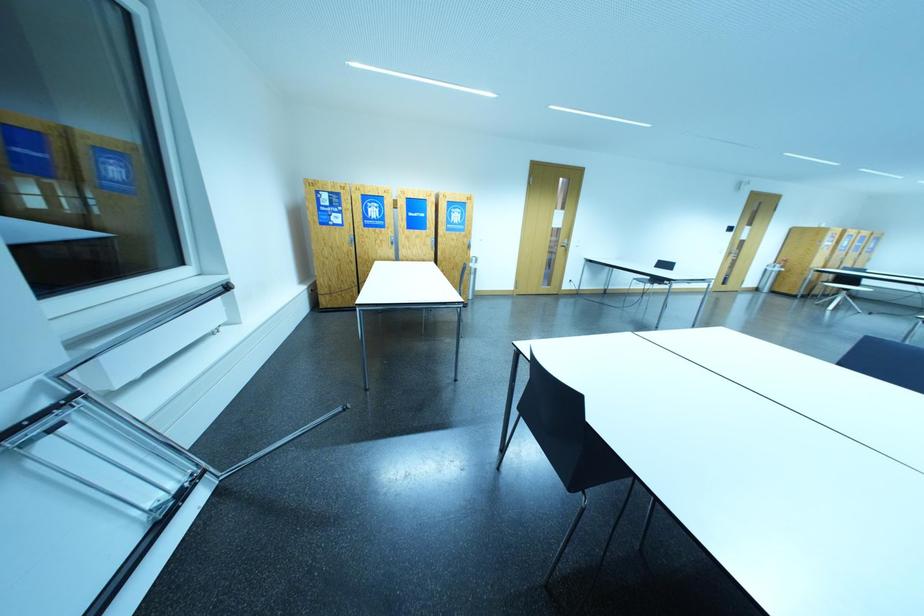
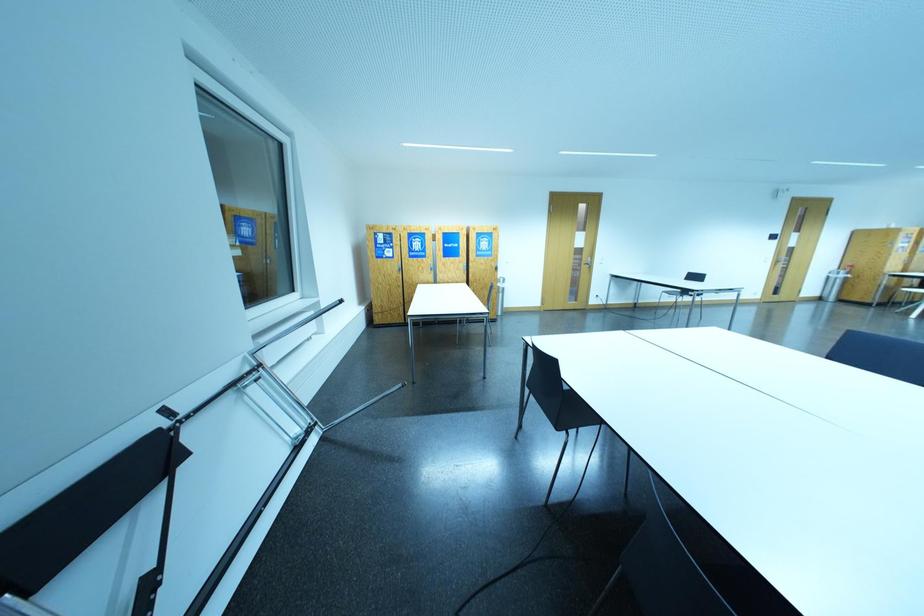
Question: The camera is either moving clockwise (left) or counter-clockwise (right) around the object. The first image is from the beginning of the video and the second image is from the end. Is the camera moving left or right when shooting the video?

Choices:
 (A) Left
 (B) Right

Answer: (B)